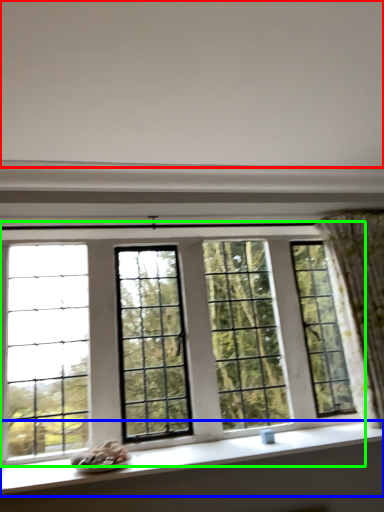
Question: Considering the real-world distances, which object is closest to backdrop (highlighted by a red box)? window sill (highlighted by a blue box) or window (highlighted by a green box).

Choices:
 (A) window sill
 (B) window

Answer: (B)